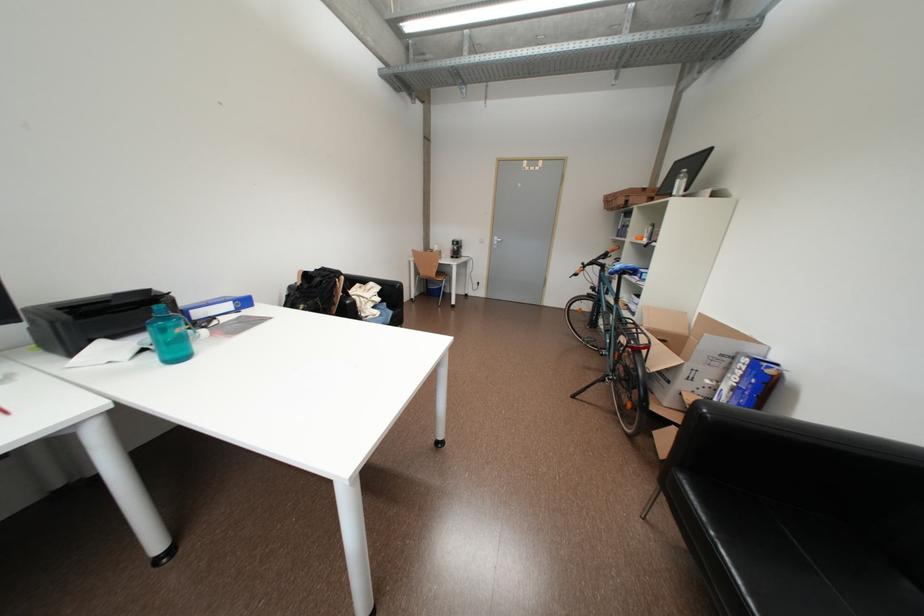
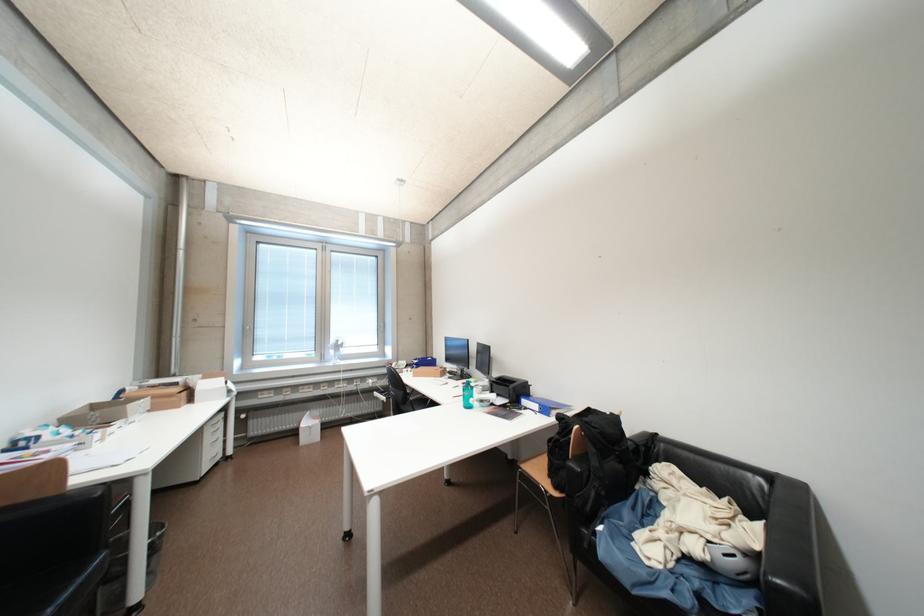
Find the pixel in the second image that matches the point at 380,286 in the first image.

(769, 528)